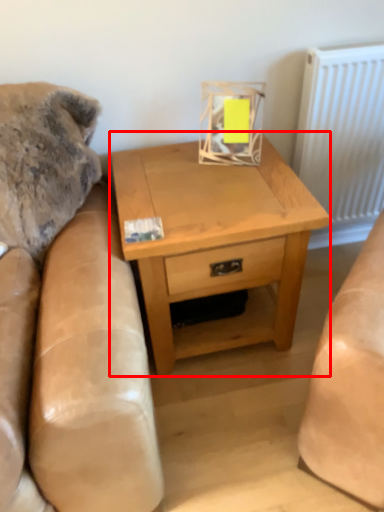
Question: Observing the image, what is the correct spatial positioning of nightstand (annotated by the red box) in reference to radiator?

Choices:
 (A) right
 (B) left

Answer: (B)